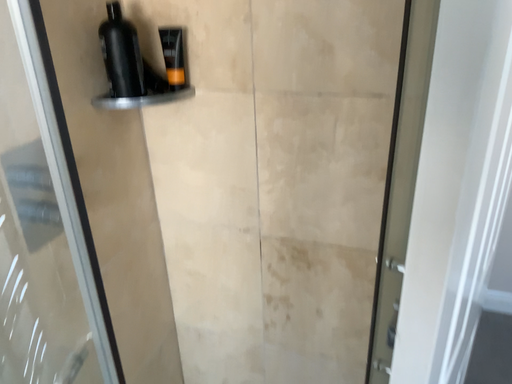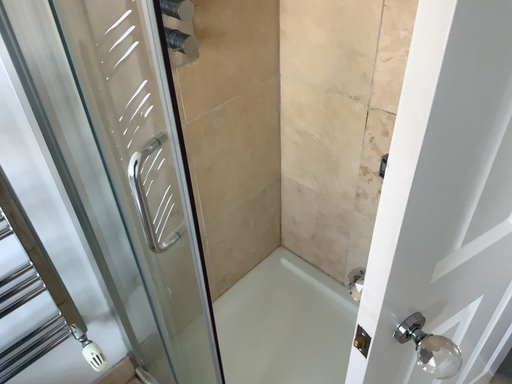
Question: How did the camera likely rotate when shooting the video?

Choices:
 (A) rotated right
 (B) rotated left

Answer: (B)